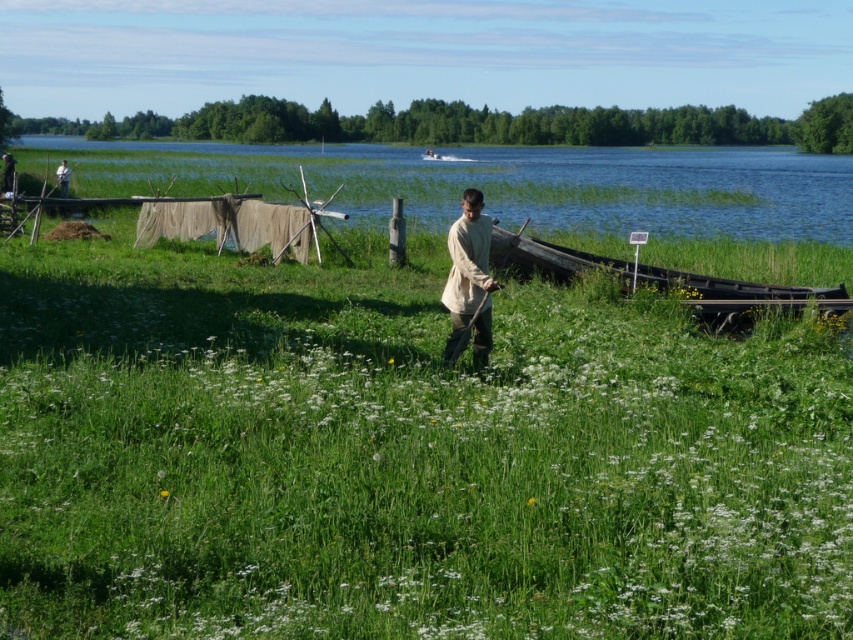
Question: Is green grassy at center wider than light brown wooden pole at upper left?

Choices:
 (A) yes
 (B) no

Answer: (A)

Question: Which object is farther from the camera taking this photo?

Choices:
 (A) light brown wooden pole at upper left
 (B) light beige fabric shirt at center
 (C) green grassy at center
 (D) dark brown wooden canoe at right

Answer: (A)

Question: Which of the following is the farthest from the observer?

Choices:
 (A) (59, 188)
 (B) (265, 163)
 (C) (486, 260)

Answer: (B)

Question: Can you confirm if green grassy at center is bigger than dark brown wooden canoe at right?

Choices:
 (A) yes
 (B) no

Answer: (A)

Question: Is blue water at upper center above light beige fabric shirt at center?

Choices:
 (A) yes
 (B) no

Answer: (A)

Question: Which object is farther from the camera taking this photo?

Choices:
 (A) light brown wooden pole at upper left
 (B) blue water at upper center
 (C) light beige fabric shirt at center
 (D) green grassy at center

Answer: (A)